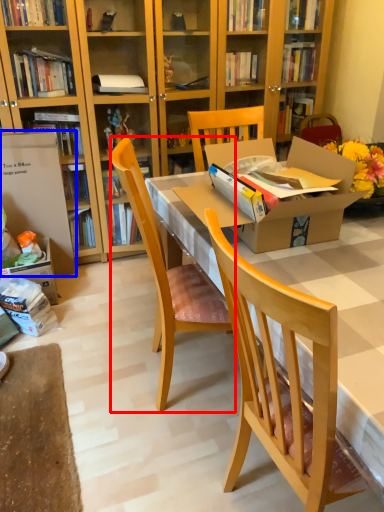
Question: Which point is closer to the camera, chair (highlighted by a red box) or box (highlighted by a blue box)?

Choices:
 (A) chair
 (B) box

Answer: (A)